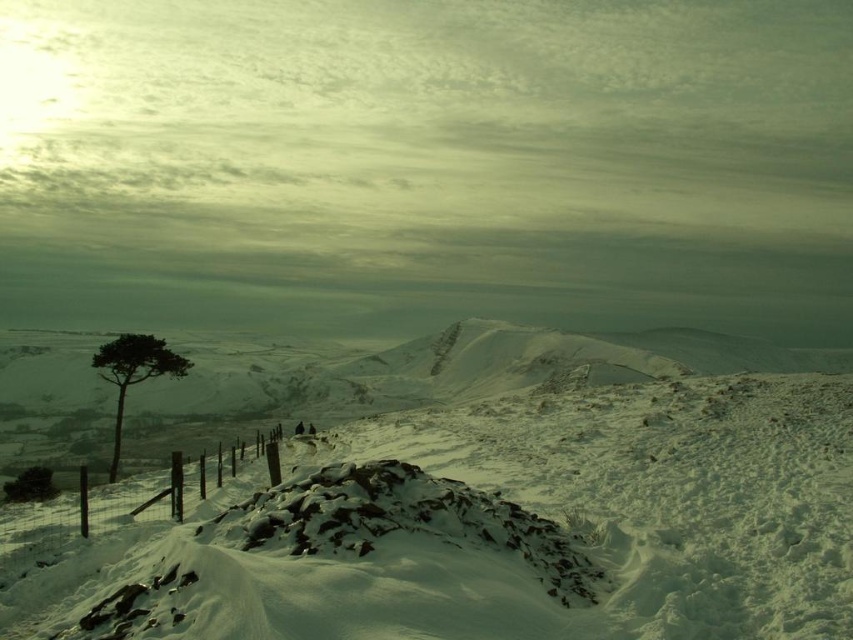
Who is positioned more to the right, wooden post fence at lower left or green leafy tree at left?

Positioned to the right is wooden post fence at lower left.

The width and height of the screenshot is (853, 640). Describe the element at coordinates (119, 502) in the screenshot. I see `wooden post fence at lower left` at that location.

Locate an element on the screen. wooden post fence at lower left is located at coordinates click(x=119, y=502).

Does white powdery snow at center have a greater width compared to green leafy tree at left?

Yes.

Who is positioned more to the right, white powdery snow at center or green leafy tree at left?

white powdery snow at center is more to the right.

Is point (433, 470) farther from camera compared to point (115, 416)?

No, it is not.

This screenshot has width=853, height=640. What are the coordinates of `white powdery snow at center` in the screenshot? It's located at (497, 506).

Is white powdery snow at center smaller than wooden post fence at lower left?

No.

Is white powdery snow at center to the left of wooden post fence at lower left from the viewer's perspective?

No, white powdery snow at center is not to the left of wooden post fence at lower left.

Is point (421, 500) positioned in front of point (61, 531)?

Yes, it is.

The height and width of the screenshot is (640, 853). Find the location of `white powdery snow at center`. white powdery snow at center is located at coordinates (497, 506).